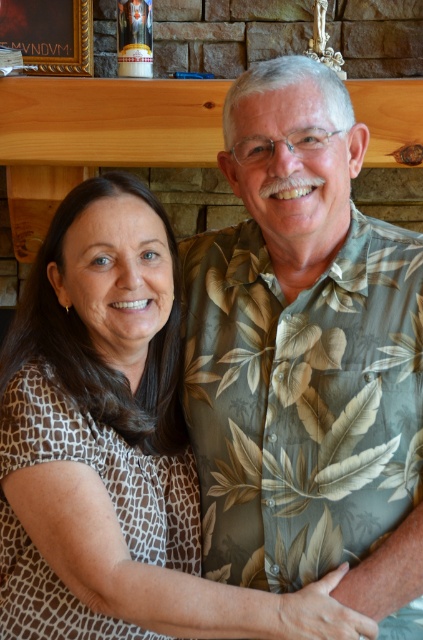
Question: Which object is the closest to the gold wooden picture frame at upper left?

Choices:
 (A) green leafy shirt at center
 (B) brown textured blouse at center

Answer: (B)

Question: Does brown textured blouse at center appear under gold wooden picture frame at upper left?

Choices:
 (A) no
 (B) yes

Answer: (B)

Question: Is green leafy shirt at center wider than gold wooden picture frame at upper left?

Choices:
 (A) yes
 (B) no

Answer: (A)

Question: Among these objects, which one is nearest to the camera?

Choices:
 (A) brown textured blouse at center
 (B) gold wooden picture frame at upper left
 (C) green leafy shirt at center

Answer: (A)

Question: Among these points, which one is farthest from the camera?

Choices:
 (A) (195, 513)
 (B) (318, 492)

Answer: (A)

Question: Does brown textured blouse at center appear under gold wooden picture frame at upper left?

Choices:
 (A) yes
 (B) no

Answer: (A)